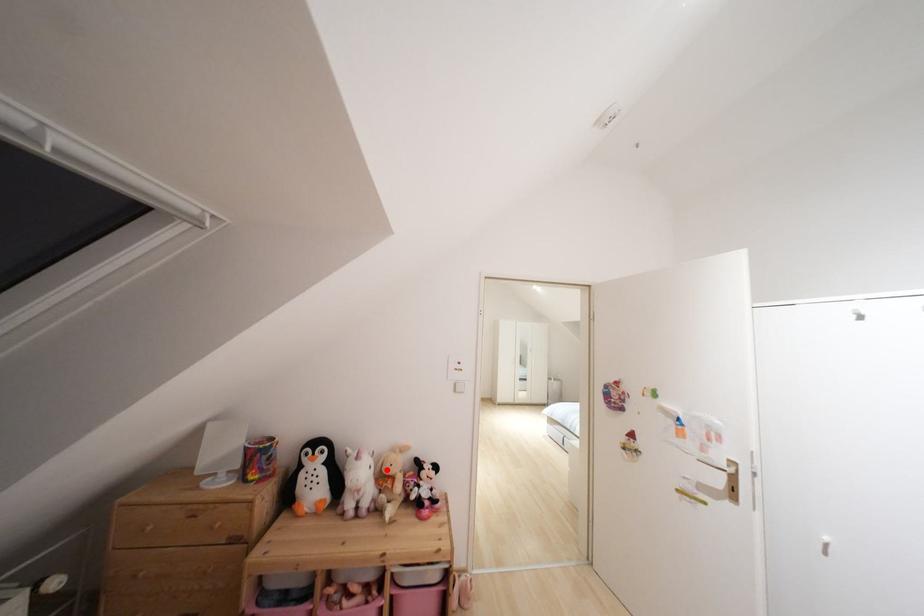
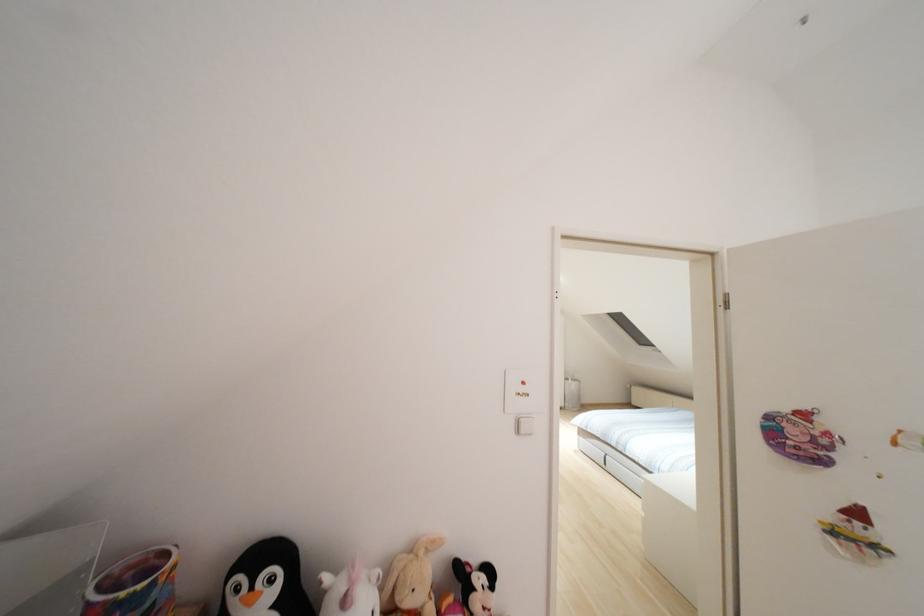
Question: I am providing you with two images of the same scene from different viewpoints. In image1, a red point is highlighted. Considering the same 3D point in image2, which of the following is correct?

Choices:
 (A) It is closer
 (B) It is farther

Answer: (A)